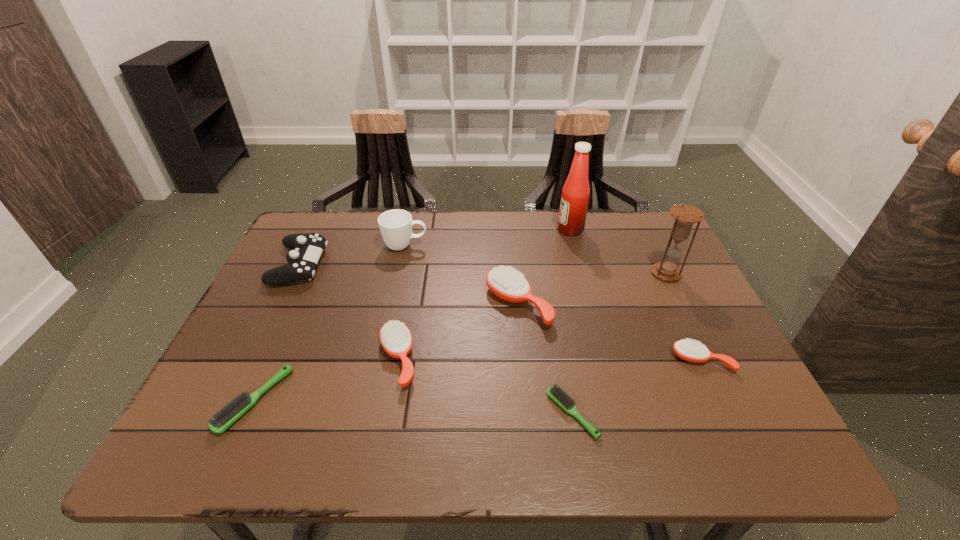
This screenshot has width=960, height=540. I want to click on the smallest orange hairbrush, so click(x=693, y=351).

Locate an element on the screen. The height and width of the screenshot is (540, 960). the rightmost hairbrush is located at coordinates (693, 351).

In order to click on the fourth tallest hairbrush in this screenshot , I will do `click(229, 414)`.

What are the coordinates of `the second shortest object` in the screenshot? It's located at (229, 414).

Find the location of a particular element. the shortest hairbrush is located at coordinates (554, 392).

Where is `the right light hairbrush`? The image size is (960, 540). the right light hairbrush is located at coordinates (554, 392).

Identify the location of free region located on the front-facing side of the tallest object. (535, 230).

Find the location of a particular element. This screenshot has height=540, width=960. vacant area situated 0.140m on the front-facing side of the tallest object is located at coordinates (512, 230).

Where is `free space located 0.220m on the front-facing side of the tallest object`? free space located 0.220m on the front-facing side of the tallest object is located at coordinates (486, 230).

Locate an element on the screen. free space located on the left of the brown hourglass is located at coordinates (549, 273).